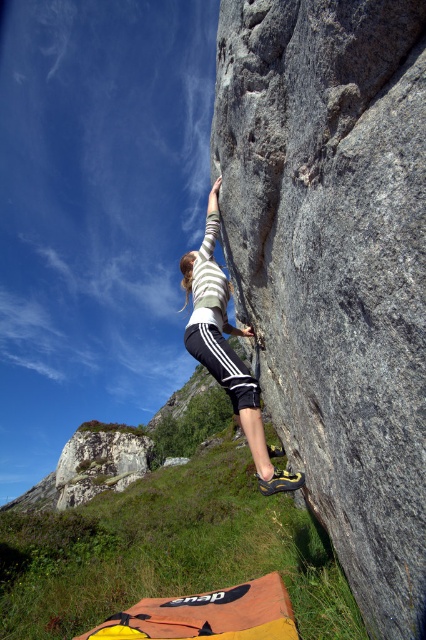
You are a climber trying to reach the top of the rock face. There is a gray rough rock at center marked by point [334,266]. Can you use this point to place your foot for support?

The gray rough rock at center is represented by point [334,266], so yes, you can use this point to place your foot for support as it is a valid hold on the rock face.

You are a photographer standing at the base of the rock face. You want to take a photo of the climber so that the gray rough rock at center and the white striped shirt at center are both visible. Which object should be placed higher in the frame to ensure both are visible?

The gray rough rock at center is positioned over the white striped shirt at center, so to ensure both are visible in the frame, the gray rough rock at center should be placed higher since it is already above the white striped shirt at center.

You are a photographer standing at the base of the rock face. You want to capture a photo of the white striped shirt at center and the gray rough rock at center in the same frame. Based on their positions, which object will appear closer to the bottom of the photo?

The gray rough rock at center is shorter than the white striped shirt at center, so it will appear closer to the bottom of the photo.